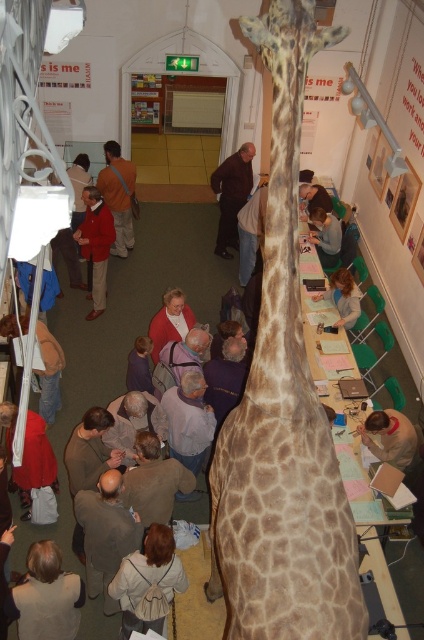
Which is below, light brown backpack at lower center or brown wool sweater at center?

light brown backpack at lower center is below.

Is point (131, 566) more distant than point (245, 168)?

No, it is in front of (245, 168).

Describe the element at coordinates (147, 580) in the screenshot. I see `light brown backpack at lower center` at that location.

Identify the location of light brown backpack at lower center. (147, 580).

Between orange shirt at left and light brown leather jacket at lower right, which one has more height?

Standing taller between the two is orange shirt at left.

Does orange shirt at left appear over light brown leather jacket at lower right?

Yes.

Who is more forward, [114,154] or [401,413]?

Positioned in front is point [401,413].

You are a GUI agent. You are given a task and a screenshot of the screen. Output one action in this format:
    pyautogui.click(x=<x>, y=<y>)
    Task: Click on the orange shirt at left
    
    Given the screenshot: What is the action you would take?
    pyautogui.click(x=119, y=195)

Between spotted fur giraffe at center and smooth beige shirt at center, which one is positioned higher?

smooth beige shirt at center is above.

Who is more distant from viewer, (273, 4) or (329, 253)?

The point (329, 253) is behind.

This screenshot has width=424, height=640. Find the location of `spotted fur giraffe at center`. spotted fur giraffe at center is located at coordinates (282, 412).